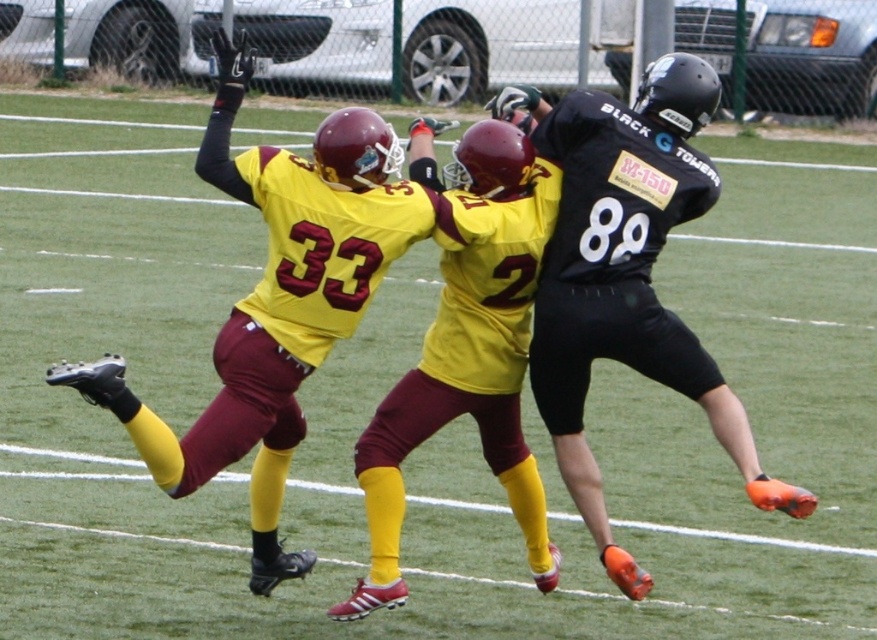
Question: Which of the following is the closest to the observer?

Choices:
 (A) maroon jersey at center
 (B) black matte jersey at center

Answer: (B)

Question: Considering the relative positions of black matte jersey at center and maroon jersey at center in the image provided, where is black matte jersey at center located with respect to maroon jersey at center?

Choices:
 (A) left
 (B) right

Answer: (B)

Question: Is black matte jersey at center smaller than maroon jersey at center?

Choices:
 (A) yes
 (B) no

Answer: (B)

Question: Can you confirm if black matte jersey at center is thinner than maroon jersey at center?

Choices:
 (A) yes
 (B) no

Answer: (B)

Question: Which of the following is the farthest from the observer?

Choices:
 (A) maroon jersey at center
 (B) black matte jersey at center

Answer: (A)